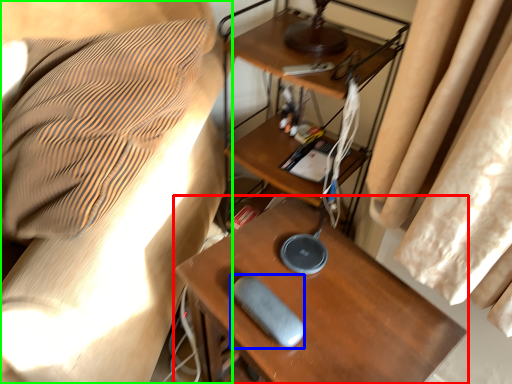
Question: Estimate the real-world distances between objects in this image. Which object is closer to table (highlighted by a red box), equipment (highlighted by a blue box) or furniture (highlighted by a green box)?

Choices:
 (A) equipment
 (B) furniture

Answer: (A)